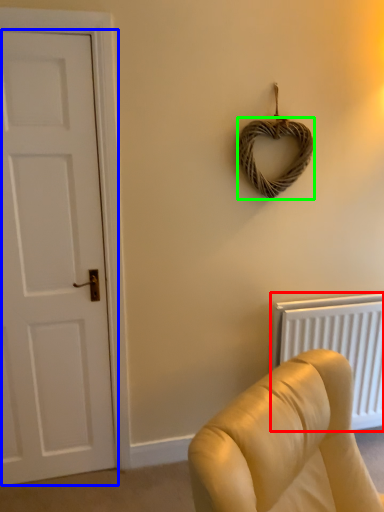
Question: Which object is positioned closest to radiator (highlighted by a red box)? Select from door (highlighted by a blue box) and rope (highlighted by a green box).

Choices:
 (A) door
 (B) rope

Answer: (B)